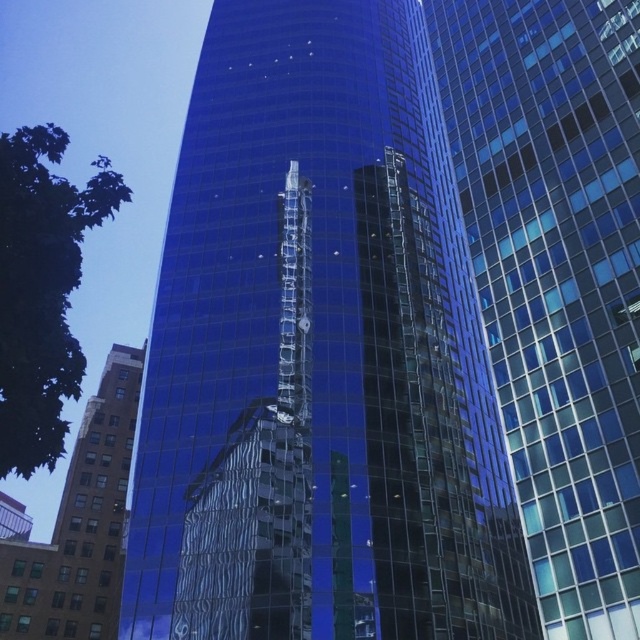
You are standing in the city square and see the glossy glass building at center and the brown brick building at lower left. Which building is positioned to the right side of the other?

The glossy glass building at center is positioned to the right of the brown brick building at lower left.

You are an architect analyzing the urban layout. Based on the scene, which building occupies more space in the image? Please compare the transparent glass building at center and the brown brick building at lower left.

The brown brick building at lower left is larger than the transparent glass building at center, so it occupies more space in the image.

You are an architect designing a new park in the city. You want to place a bench between the glossy glass building at center and the transparent glass building at center so that it is equidistant from both. Is this possible given their current positions?

The glossy glass building at center and transparent glass building at center are 18.90 meters apart. To place a bench equidistant from both, it would need to be positioned exactly halfway between them, which is 9.45 meters from each building. This is possible as long as there is enough space between them to accommodate the bench.